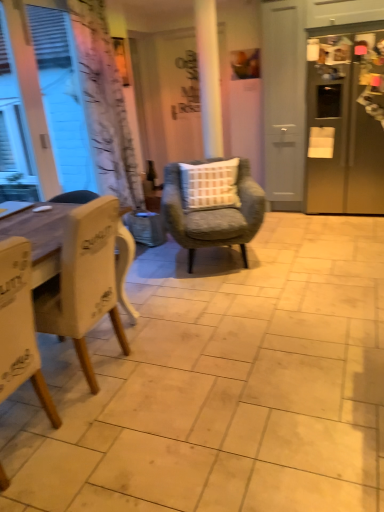
Identify the location of free spot in front of satin silver refrigerator at right. (334, 242).